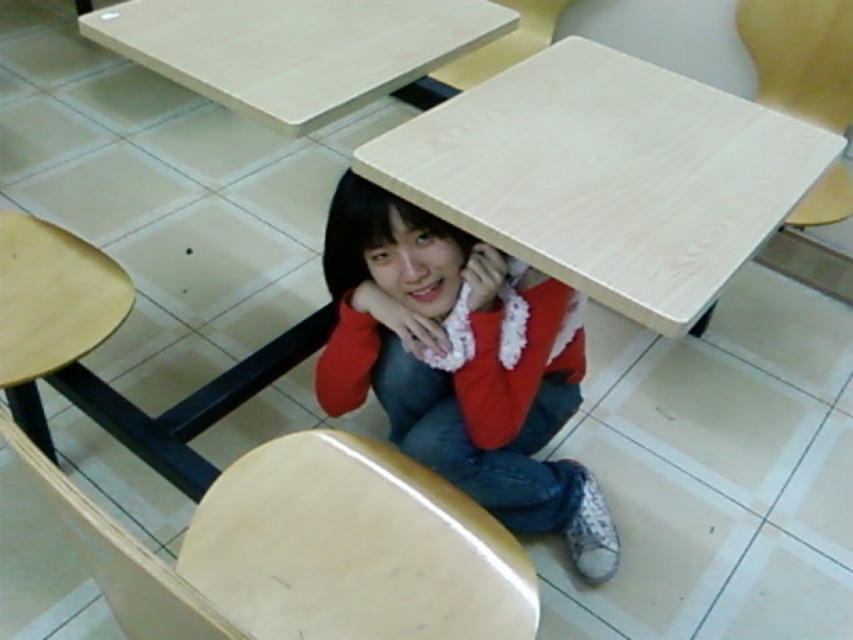
Based on the photo, can you confirm if light wood/wooden table at center is positioned to the right of light wood/wooden chair at lower left?

Correct, you'll find light wood/wooden table at center to the right of light wood/wooden chair at lower left.

Which is behind, point (701, 310) or point (224, 627)?

Point (701, 310)

You are a GUI agent. You are given a task and a screenshot of the screen. Output one action in this format:
    pyautogui.click(x=<x>, y=<y>)
    Task: Click on the light wood/wooden table at center
    The width and height of the screenshot is (853, 640).
    Given the screenshot: What is the action you would take?
    pyautogui.click(x=607, y=176)

Between light wood/wooden table at upper center and wooden chair at upper right, which one appears on the right side from the viewer's perspective?

wooden chair at upper right is more to the right.

Does light wood/wooden table at upper center appear on the left side of wooden chair at upper right?

Yes, light wood/wooden table at upper center is to the left of wooden chair at upper right.

Locate an element on the screen. light wood/wooden table at upper center is located at coordinates (294, 49).

Which is above, red fleece sweater at lower center or light wood/wooden chair at lower left?

red fleece sweater at lower center

Is the position of red fleece sweater at lower center less distant than that of light wood/wooden chair at lower left?

That is False.

Does point (440, 244) come closer to viewer compared to point (126, 576)?

No.

You are a GUI agent. You are given a task and a screenshot of the screen. Output one action in this format:
    pyautogui.click(x=<x>, y=<y>)
    Task: Click on the red fleece sweater at lower center
    
    Given the screenshot: What is the action you would take?
    pyautogui.click(x=461, y=364)